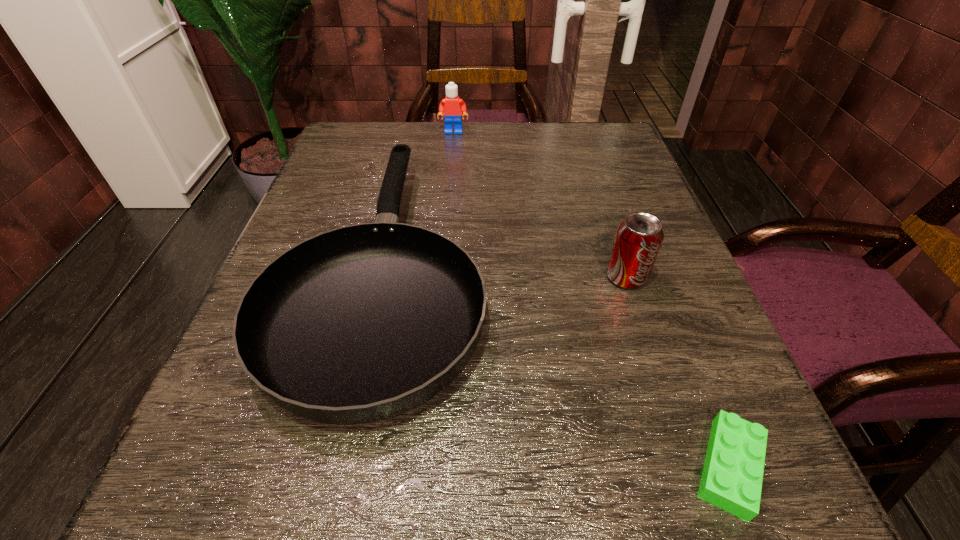
Find the location of a particular element. This screenshot has width=960, height=540. free space between the farthest object and the frying pan is located at coordinates (420, 200).

Identify the location of free area in between the soda can and the farthest object. (540, 204).

Image resolution: width=960 pixels, height=540 pixels. What are the coordinates of `free space between the taller Lego and the right Lego` in the screenshot? It's located at (591, 300).

Where is `free space between the left Lego and the second shortest object`? The image size is (960, 540). free space between the left Lego and the second shortest object is located at coordinates (420, 200).

You are a GUI agent. You are given a task and a screenshot of the screen. Output one action in this format:
    pyautogui.click(x=<x>, y=<y>)
    Task: Click on the free space between the left Lego and the second shortest object
    This screenshot has width=960, height=540.
    Given the screenshot: What is the action you would take?
    pyautogui.click(x=420, y=200)

Where is `free space that is in between the taller Lego and the nearer Lego`? Image resolution: width=960 pixels, height=540 pixels. free space that is in between the taller Lego and the nearer Lego is located at coordinates (591, 300).

This screenshot has width=960, height=540. What are the coordinates of `object that is the nearest to the shortest object` in the screenshot? It's located at (638, 239).

You are a GUI agent. You are given a task and a screenshot of the screen. Output one action in this format:
    pyautogui.click(x=<x>, y=<y>)
    Task: Click on the object that ranks as the third closest to the shorter Lego
    Image resolution: width=960 pixels, height=540 pixels.
    Given the screenshot: What is the action you would take?
    pyautogui.click(x=452, y=106)

You are a GUI agent. You are given a task and a screenshot of the screen. Output one action in this format:
    pyautogui.click(x=<x>, y=<y>)
    Task: Click on the vacant area that satisfies the following two spatial constraints: 1. on the face of the right Lego; 2. on the left side of the farthest object
    
    Given the screenshot: What is the action you would take?
    pyautogui.click(x=423, y=467)